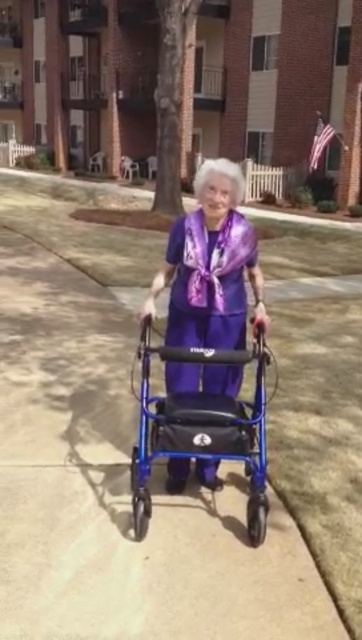
Looking at this image, is smooth concrete sidewalk at center below purple fabric walker at center?

No, smooth concrete sidewalk at center is not below purple fabric walker at center.

Is point (334, 296) behind point (240, 280)?

Yes.

Does point (104, 593) lie in front of point (199, 300)?

Yes.

Locate an element on the screen. This screenshot has height=640, width=362. smooth concrete sidewalk at center is located at coordinates (102, 432).

Which of these two, smooth concrete sidewalk at center or blue metallic walker at center, stands shorter?

Standing shorter between the two is blue metallic walker at center.

Is point (326, 451) closer to camera compared to point (233, 449)?

No, (326, 451) is behind (233, 449).

The width and height of the screenshot is (362, 640). What are the coordinates of `smooth concrete sidewalk at center` in the screenshot? It's located at (102, 432).

From the picture: Can you confirm if purple fabric walker at center is shorter than blue metallic walker at center?

Yes, purple fabric walker at center is shorter than blue metallic walker at center.

Consider the image. Between purple fabric walker at center and blue metallic walker at center, which one appears on the left side from the viewer's perspective?

Positioned to the left is blue metallic walker at center.

Which is in front, point (264, 324) or point (195, 401)?

Positioned in front is point (264, 324).

Where is `purple fabric walker at center`? The image size is (362, 640). purple fabric walker at center is located at coordinates (211, 266).